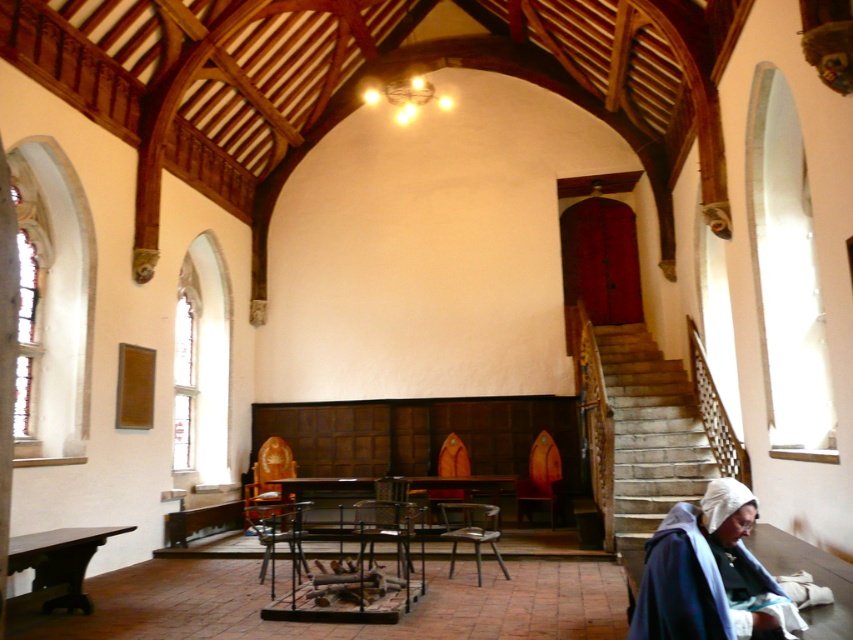
Question: Is wooden staircase at right to the right of wooden table at lower right from the viewer's perspective?

Choices:
 (A) yes
 (B) no

Answer: (A)

Question: Considering the real-world distances, which object is farthest from the wooden table at lower right?

Choices:
 (A) wooden table at lower left
 (B) wooden table at center

Answer: (A)

Question: Can you confirm if wooden table at lower right is positioned to the right of wooden table at center?

Choices:
 (A) yes
 (B) no

Answer: (A)

Question: Which is nearer to the wooden table at lower right?

Choices:
 (A) wooden staircase at right
 (B) wooden table at lower left
 (C) dark blue woolen robe at lower right

Answer: (C)

Question: Among these objects, which one is nearest to the camera?

Choices:
 (A) dark blue woolen robe at lower right
 (B) wooden staircase at right
 (C) wooden table at center

Answer: (A)

Question: Is wooden staircase at right bigger than dark blue woolen robe at lower right?

Choices:
 (A) yes
 (B) no

Answer: (A)